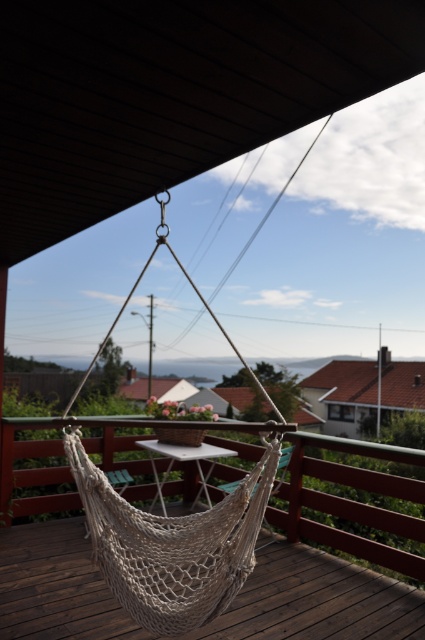
Question: Observing the image, what is the correct spatial positioning of white rope hammock at center in reference to white mesh hammock at center?

Choices:
 (A) right
 (B) left

Answer: (B)

Question: Is white rope hammock at center smaller than white mesh hammock at center?

Choices:
 (A) yes
 (B) no

Answer: (A)

Question: Among these points, which one is farthest from the camera?

Choices:
 (A) (119, 525)
 (B) (144, 524)

Answer: (A)

Question: Is white rope hammock at center wider than white mesh hammock at center?

Choices:
 (A) no
 (B) yes

Answer: (A)